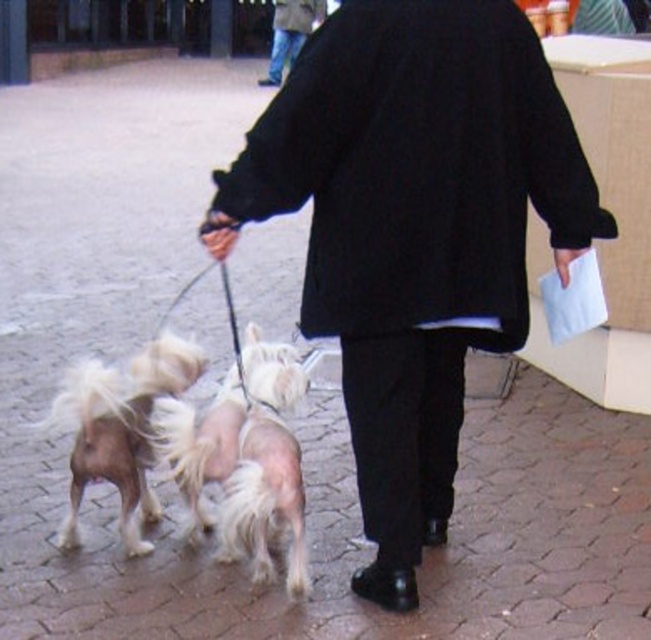
Question: Is shiny white fur at center to the right of shiny golden fur at center from the viewer's perspective?

Choices:
 (A) yes
 (B) no

Answer: (A)

Question: Which object is closer to the camera taking this photo?

Choices:
 (A) shiny brown fur at lower left
 (B) shiny white fur at center
 (C) black wool coat at upper center
 (D) shiny golden fur at center

Answer: (B)

Question: Can you confirm if shiny brown fur at lower left is thinner than shiny white fur at center?

Choices:
 (A) no
 (B) yes

Answer: (A)

Question: Can you confirm if shiny brown fur at lower left is bigger than black wool coat at upper center?

Choices:
 (A) yes
 (B) no

Answer: (B)

Question: Which point is closer to the camera taking this photo?

Choices:
 (A) (305, 22)
 (B) (104, 378)
 (C) (298, 528)
 (D) (178, 486)

Answer: (C)

Question: Considering the real-world distances, which object is farthest from the shiny white fur at center?

Choices:
 (A) black wool coat at upper center
 (B) shiny brown fur at lower left
 (C) shiny golden fur at center

Answer: (A)